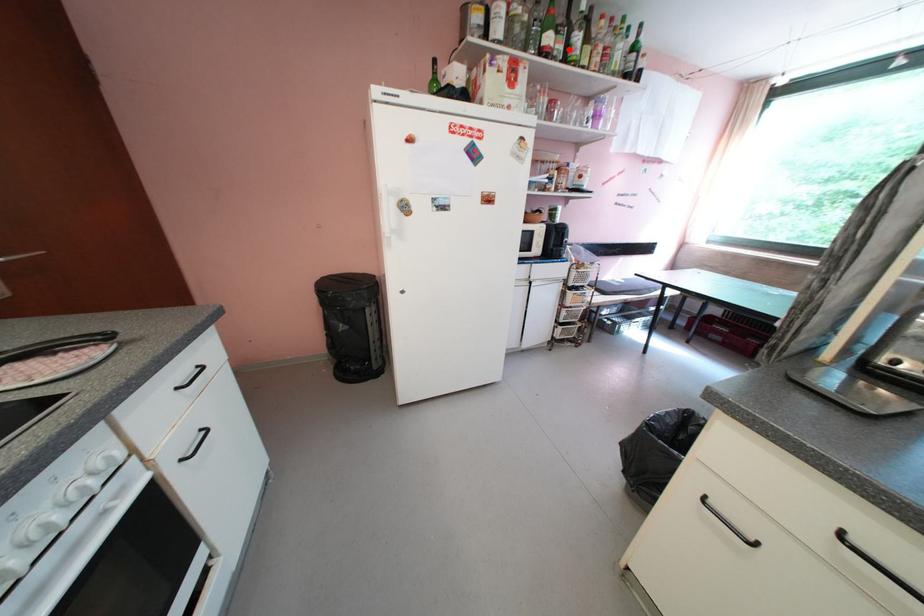
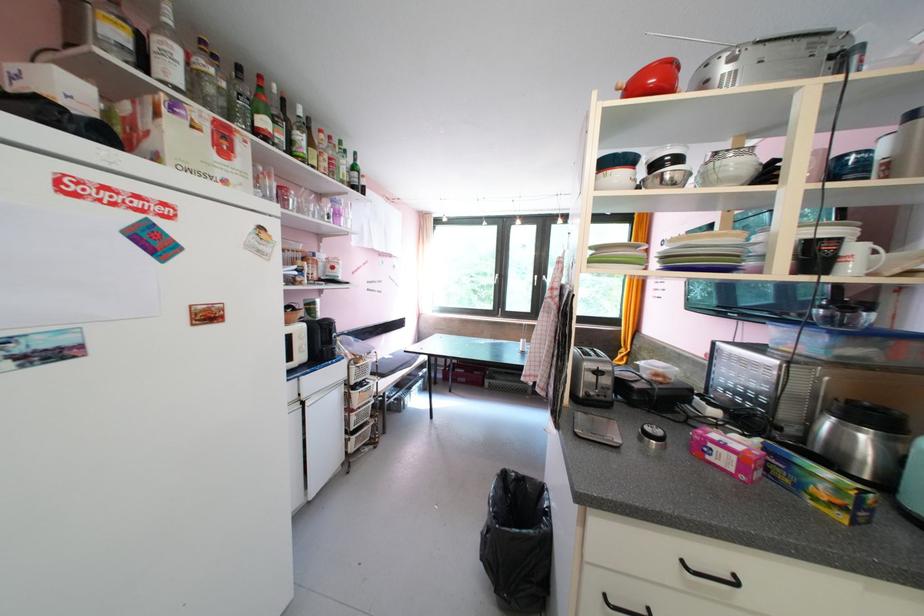
Find the pixel in the second image that matches the highlighted location in the first image.

(290, 140)